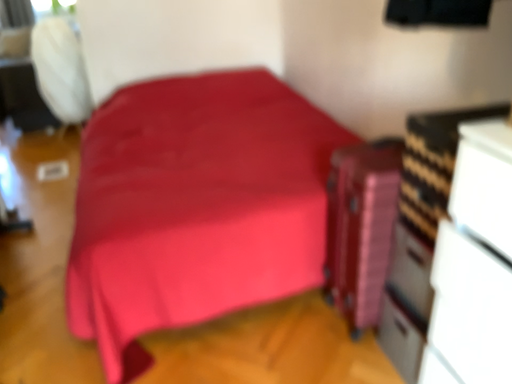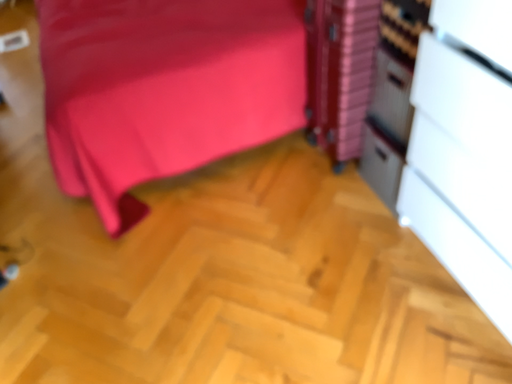
Question: Which way did the camera rotate in the video?

Choices:
 (A) rotated downward
 (B) rotated upward

Answer: (A)